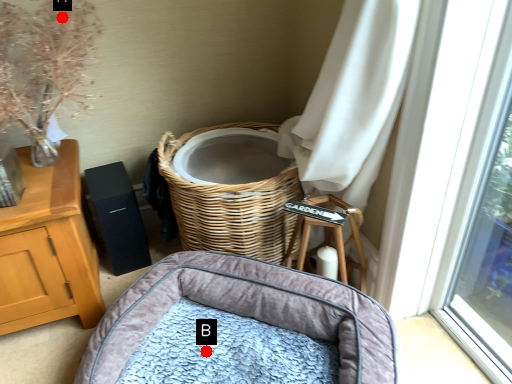
Question: Two points are circled on the image, labeled by A and B beside each circle. Which point appears farthest from the camera in this image?

Choices:
 (A) A is further
 (B) B is further

Answer: (A)